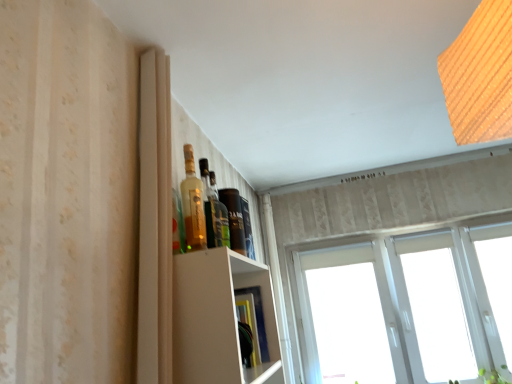
Question: Is wooden textured light at upper right positioned with its back to white plastic window at upper right?

Choices:
 (A) no
 (B) yes

Answer: (B)

Question: Is wooden textured light at upper right directly adjacent to white plastic window at upper right?

Choices:
 (A) yes
 (B) no

Answer: (B)

Question: Is white plastic window at upper right inside wooden textured light at upper right?

Choices:
 (A) no
 (B) yes

Answer: (A)

Question: Does wooden textured light at upper right come behind white plastic window at upper right?

Choices:
 (A) no
 (B) yes

Answer: (A)

Question: Considering the relative sizes of wooden textured light at upper right and white plastic window at upper right in the image provided, is wooden textured light at upper right shorter than white plastic window at upper right?

Choices:
 (A) no
 (B) yes

Answer: (B)

Question: Is white plastic window at upper right in front of or behind green leafy plant at lower right in the image?

Choices:
 (A) front
 (B) behind

Answer: (B)

Question: From a real-world perspective, is white plastic window at upper right positioned above or below green leafy plant at lower right?

Choices:
 (A) below
 (B) above

Answer: (B)

Question: Is point (394, 302) positioned closer to the camera than point (493, 377)?

Choices:
 (A) closer
 (B) farther

Answer: (B)

Question: In terms of size, does white plastic window at upper right appear bigger or smaller than green leafy plant at lower right?

Choices:
 (A) small
 (B) big

Answer: (B)

Question: Is wooden textured light at upper right in front of or behind translucent glass bottle at upper center, placed as the 2th bottle when sorted from back to front, in the image?

Choices:
 (A) front
 (B) behind

Answer: (A)

Question: Is wooden textured light at upper right taller or shorter than translucent glass bottle at upper center, which is the 1th bottle from front to back?

Choices:
 (A) tall
 (B) short

Answer: (A)

Question: Visually, is wooden textured light at upper right positioned to the left or to the right of translucent glass bottle at upper center, placed as the 2th bottle when sorted from back to front?

Choices:
 (A) right
 (B) left

Answer: (A)

Question: Would you say wooden textured light at upper right is inside or outside translucent glass bottle at upper center, which is the 1th bottle from front to back?

Choices:
 (A) inside
 (B) outside

Answer: (B)

Question: Is white plastic window at upper right spatially inside translucent glass bottle at upper center, arranged as the second bottle when viewed from the front, or outside of it?

Choices:
 (A) inside
 (B) outside

Answer: (B)

Question: Visually, is white plastic window at upper right positioned to the left or to the right of translucent glass bottle at upper center, arranged as the second bottle when viewed from the front?

Choices:
 (A) left
 (B) right

Answer: (B)